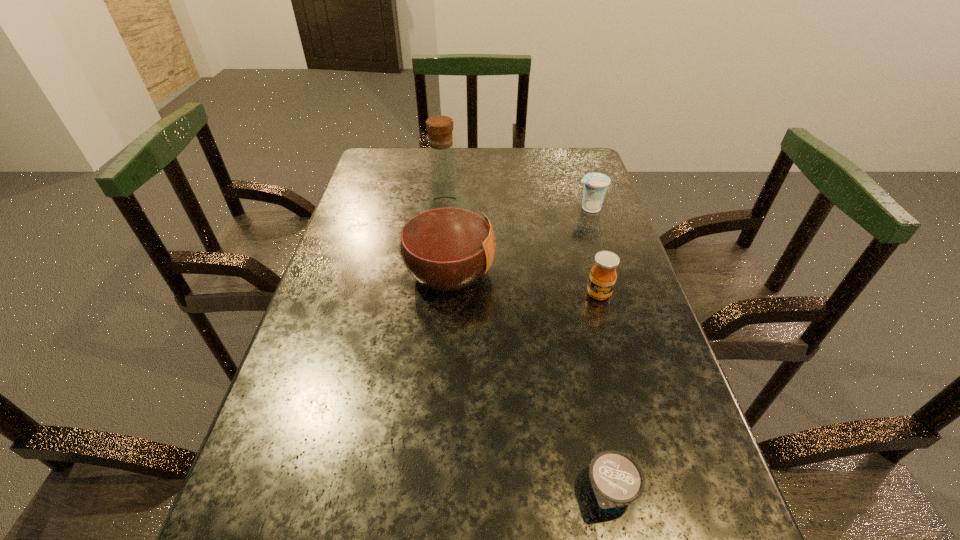
Where is `vacant space located 0.050m on the back of the nearer yogurt`? vacant space located 0.050m on the back of the nearer yogurt is located at coordinates (599, 435).

I want to click on honey present at the right edge, so click(602, 278).

Where is `free space at the far edge`? Image resolution: width=960 pixels, height=540 pixels. free space at the far edge is located at coordinates (425, 174).

Locate an element on the screen. free space at the left edge is located at coordinates (343, 247).

Identify the location of free space at the right edge of the desktop. (608, 194).

In the image, there is a desktop. Where is `free space at the far right corner`? This screenshot has width=960, height=540. free space at the far right corner is located at coordinates (575, 182).

Where is `empty location between the liquor and the honey`? The height and width of the screenshot is (540, 960). empty location between the liquor and the honey is located at coordinates (524, 283).

Where is `vacant region between the third tallest object and the honey`? vacant region between the third tallest object and the honey is located at coordinates (594, 251).

You are a GUI agent. You are given a task and a screenshot of the screen. Output one action in this format:
    pyautogui.click(x=<x>, y=<y>)
    Task: Click on the free space that is in between the right yogurt and the honey
    The height and width of the screenshot is (540, 960).
    Given the screenshot: What is the action you would take?
    pyautogui.click(x=594, y=251)

Locate an element on the screen. Image resolution: width=960 pixels, height=540 pixels. empty space between the left yogurt and the farther yogurt is located at coordinates (600, 349).